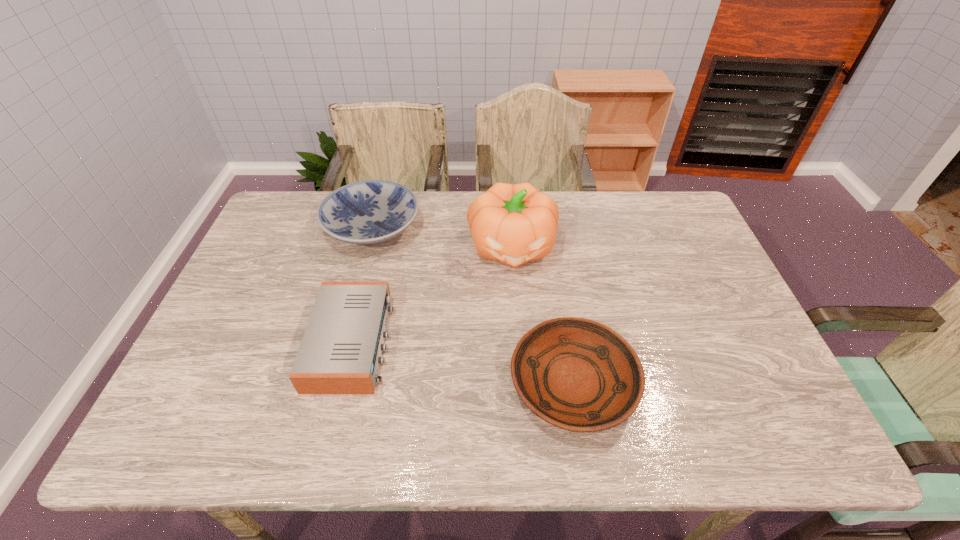
I want to click on the tallest object, so click(x=513, y=224).

Locate an element on the screen. This screenshot has width=960, height=540. the farther plate is located at coordinates (371, 212).

Identify the location of the taller plate. The image size is (960, 540). (371, 212).

Find the location of a particular element. This screenshot has height=540, width=960. radio receiver is located at coordinates (340, 352).

I want to click on the shorter plate, so click(577, 374).

Locate an element on the screen. This screenshot has width=960, height=540. the right plate is located at coordinates (577, 374).

Locate an element on the screen. free location located 0.360m on the carved face of the pumpkin is located at coordinates (522, 390).

The height and width of the screenshot is (540, 960). In order to click on vacant region located on the right of the second tallest object in this screenshot , I will do `click(461, 227)`.

This screenshot has height=540, width=960. I want to click on free space located on the front panel of the radio receiver, so click(x=449, y=342).

Locate an element on the screen. This screenshot has width=960, height=540. free space located 0.070m on the right of the right plate is located at coordinates (665, 383).